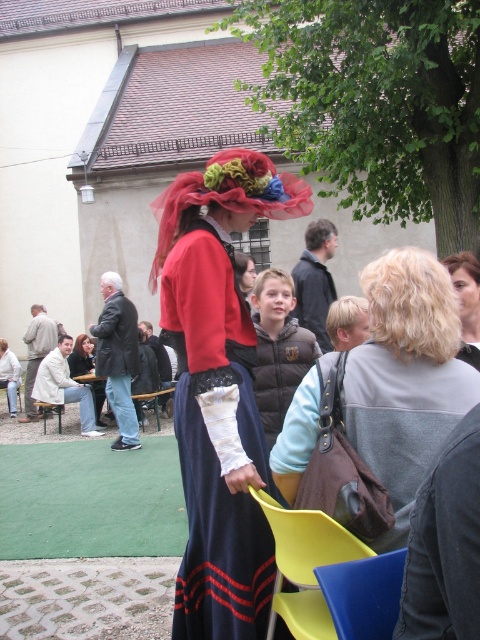
Question: Which point appears farthest from the camera in this image?

Choices:
 (A) (157, 355)
 (B) (321, 256)
 (C) (396, 584)
 (D) (23, 337)

Answer: (D)

Question: Estimate the real-world distances between objects in this image. Which object is farther from the brown quilted vest at center?

Choices:
 (A) yellow plastic chair at lower center
 (B) blonde hair at upper right

Answer: (A)

Question: Based on their relative distances, which object is nearer to the brown leather jacket at center?

Choices:
 (A) brown quilted vest at center
 (B) matte brown purse at center

Answer: (A)

Question: Is translucent tulle headdress at center smaller than yellow plastic chair at center?

Choices:
 (A) yes
 (B) no

Answer: (A)

Question: Is brown leather jacket at center bigger than blonde hair at upper right?

Choices:
 (A) no
 (B) yes

Answer: (B)

Question: Where is yellow plastic chair at center located in relation to light beige fabric coat at left in the image?

Choices:
 (A) above
 (B) below

Answer: (B)